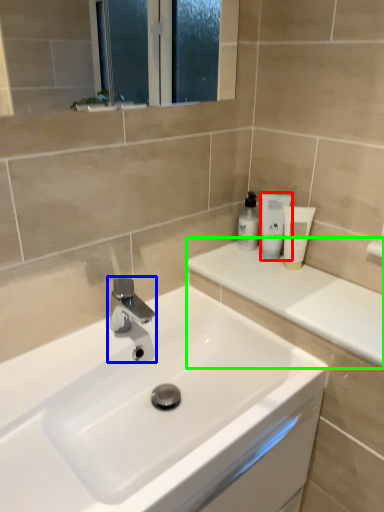
Question: Considering the real-world distances, which object is farthest from toiletry (highlighted by a red box)? tap (highlighted by a blue box) or counter top (highlighted by a green box)?

Choices:
 (A) tap
 (B) counter top

Answer: (A)